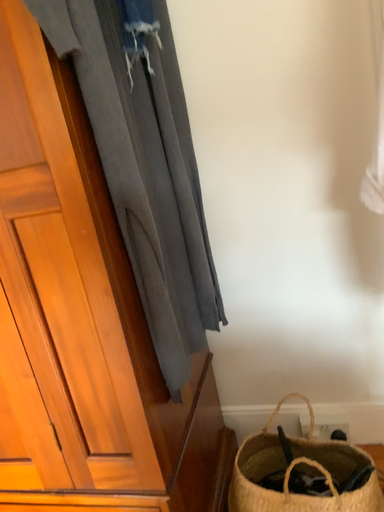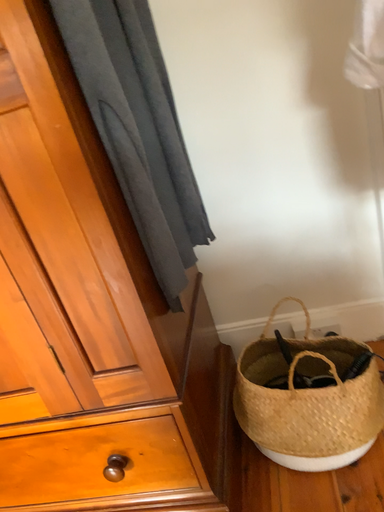
Question: How did the camera likely rotate when shooting the video?

Choices:
 (A) rotated upward
 (B) rotated downward

Answer: (B)